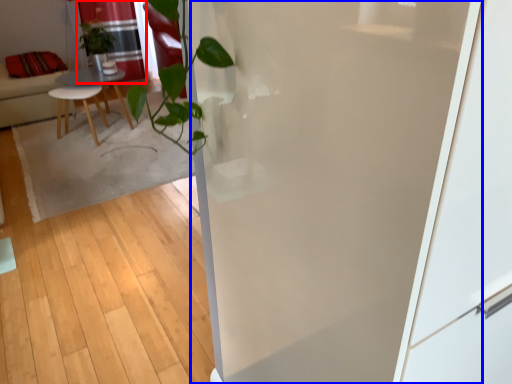
Question: Which object is closer to the camera taking this photo, curtain (highlighted by a red box) or screen door (highlighted by a blue box)?

Choices:
 (A) curtain
 (B) screen door

Answer: (B)